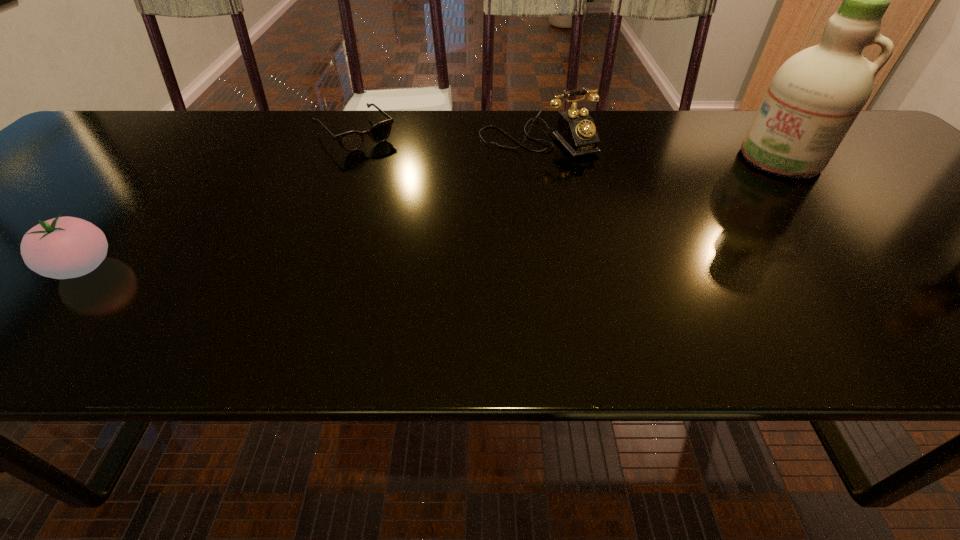
You are a GUI agent. You are given a task and a screenshot of the screen. Output one action in this format:
    pyautogui.click(x=<x>, y=<y>)
    Task: Click on the sunglasses at the far edge
    
    Given the screenshot: What is the action you would take?
    pyautogui.click(x=351, y=141)

Image resolution: width=960 pixels, height=540 pixels. Find the location of `object that is at the near edge`. object that is at the near edge is located at coordinates 63,247.

What are the coordinates of `vacant space at the far edge` in the screenshot? It's located at (448, 148).

Where is `free space at the near edge`? free space at the near edge is located at coordinates (509, 286).

In order to click on free region at the right edge of the desktop in this screenshot , I will do `click(928, 214)`.

The image size is (960, 540). In order to click on free space between the second shortest object and the rightmost object in this screenshot , I will do `click(432, 213)`.

Identify the location of vacant space that is in between the telephone and the rightmost object. The height and width of the screenshot is (540, 960). (659, 149).

The height and width of the screenshot is (540, 960). What are the coordinates of `free space between the shortest object and the third tallest object` in the screenshot? It's located at (219, 200).

Find the location of a particular element. The width and height of the screenshot is (960, 540). free area in between the second object from right to left and the cleansing agent is located at coordinates (659, 149).

I want to click on vacant area between the tomato and the third shortest object, so click(310, 203).